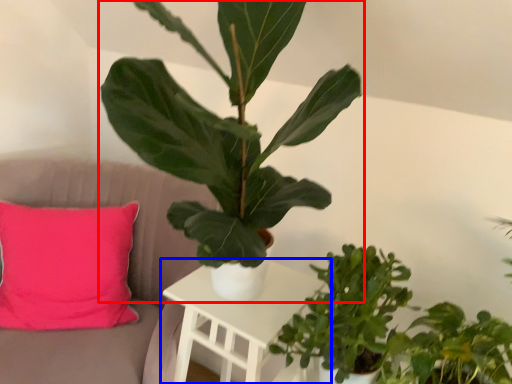
Question: Which object is closer to the camera taking this photo, houseplant (highlighted by a red box) or table (highlighted by a blue box)?

Choices:
 (A) houseplant
 (B) table

Answer: (A)